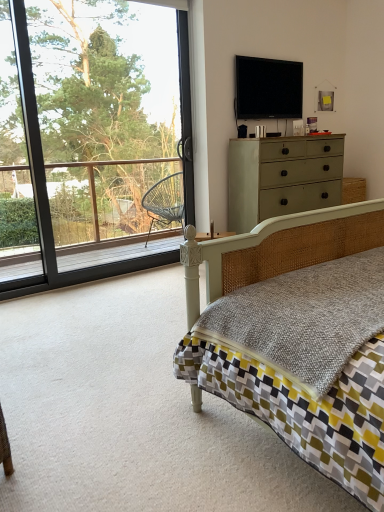
Image resolution: width=384 pixels, height=512 pixels. Describe the element at coordinates (88, 139) in the screenshot. I see `transparent glass window at upper left` at that location.

Describe the element at coordinates (300, 337) in the screenshot. This screenshot has height=512, width=384. I see `matte wicker bed at center` at that location.

You are a GUI agent. You are given a task and a screenshot of the screen. Output one action in this format:
    pyautogui.click(x=<x>, y=<y>)
    Task: Click on the transparent glass window at upper left
    This screenshot has width=384, height=512.
    Given the screenshot: What is the action you would take?
    pyautogui.click(x=88, y=139)

Considering the relative sizes of flat screen tv at upper center and matte wicker bed at center in the image provided, is flat screen tv at upper center wider than matte wicker bed at center?

No, flat screen tv at upper center is not wider than matte wicker bed at center.

Is flat screen tv at upper center closer to the viewer compared to matte wicker bed at center?

No, it is not.

From the image's perspective, does flat screen tv at upper center appear higher than matte wicker bed at center?

Yes.

How much distance is there between flat screen tv at upper center and matte wicker bed at center?

They are 2.55 meters apart.

Which of these two, transparent glass window at upper left or matte wicker bed at center, is smaller?

transparent glass window at upper left.

Is transparent glass window at upper left to the right of matte wicker bed at center from the viewer's perspective?

In fact, transparent glass window at upper left is to the left of matte wicker bed at center.

Is transparent glass window at upper left in front of or behind matte wicker bed at center in the image?

transparent glass window at upper left is behind matte wicker bed at center.

How many degrees apart are the facing directions of transparent glass window at upper left and matte wicker bed at center?

The angle between the facing direction of transparent glass window at upper left and the facing direction of matte wicker bed at center is 180 degrees.

Does matte wicker bed at center have a lesser width compared to matte green dresser at upper right?

In fact, matte wicker bed at center might be wider than matte green dresser at upper right.

From the image's perspective, between matte wicker bed at center and matte green dresser at upper right, who is located below?

matte wicker bed at center, from the image's perspective.

Which is less distant, [257,318] or [258,151]?

The point [257,318] is closer.

Is matte wicker bed at center facing towards matte green dresser at upper right?

No, matte wicker bed at center is not facing towards matte green dresser at upper right.

Considering the positions of point (151, 157) and point (257, 114), is point (151, 157) closer or farther from the camera than point (257, 114)?

Clearly, point (151, 157) is more distant from the camera than point (257, 114).

Is transparent glass window at upper left completely or partially outside of flat screen tv at upper center?

Yes, transparent glass window at upper left is outside of flat screen tv at upper center.

The width and height of the screenshot is (384, 512). Identify the location of window lying in front of the flat screen tv at upper center. (88, 139).

How far apart are transparent glass window at upper left and flat screen tv at upper center?

They are 7.39 feet apart.

Is transparent glass window at upper left oriented away from matte green dresser at upper right?

No, transparent glass window at upper left is not facing away from matte green dresser at upper right.

From a real-world perspective, is transparent glass window at upper left above or below matte green dresser at upper right?

From a real-world perspective, transparent glass window at upper left is physically above matte green dresser at upper right.

From the image's perspective, which is above, transparent glass window at upper left or matte green dresser at upper right?

transparent glass window at upper left is shown above in the image.

From the picture: Which object is positioned more to the left, transparent glass window at upper left or matte green dresser at upper right?

transparent glass window at upper left is more to the left.

The image size is (384, 512). Find the location of `the chest of drawers that is in front of the flat screen tv at upper center`. the chest of drawers that is in front of the flat screen tv at upper center is located at coordinates (282, 178).

From the image's perspective, is matte green dresser at upper right below flat screen tv at upper center?

Indeed, from the image's perspective, matte green dresser at upper right is shown beneath flat screen tv at upper center.

Consider the image. In terms of height, does matte green dresser at upper right look taller or shorter compared to flat screen tv at upper center?

matte green dresser at upper right is taller than flat screen tv at upper center.

Can you confirm if matte green dresser at upper right is positioned to the left of flat screen tv at upper center?

No.

Can you confirm if matte green dresser at upper right is wider than matte wicker bed at center?

No, matte green dresser at upper right is not wider than matte wicker bed at center.

Which is behind, point (241, 196) or point (341, 398)?

The point (241, 196) is farther.

From the image's perspective, between matte green dresser at upper right and matte wicker bed at center, which one is located above?

matte green dresser at upper right.

Image resolution: width=384 pixels, height=512 pixels. In order to click on television on the left of matte wicker bed at center in this screenshot , I will do `click(267, 89)`.

The image size is (384, 512). Find the location of `bed in front of the transparent glass window at upper left`. bed in front of the transparent glass window at upper left is located at coordinates (300, 337).

From the image, which object appears to be nearer to flat screen tv at upper center, transparent glass window at upper left or matte wicker bed at center?

Among the two, transparent glass window at upper left is located nearer to flat screen tv at upper center.

Which object lies further to the anchor point matte wicker bed at center, transparent glass window at upper left or matte green dresser at upper right?

Among the two, transparent glass window at upper left is located further to matte wicker bed at center.

Based on their spatial positions, is transparent glass window at upper left or matte green dresser at upper right closer to flat screen tv at upper center?

matte green dresser at upper right.

From the picture: Considering their positions, is matte wicker bed at center positioned further to transparent glass window at upper left than flat screen tv at upper center?

matte wicker bed at center lies further to transparent glass window at upper left than the other object.

Estimate the real-world distances between objects in this image. Which object is closer to matte wicker bed at center, flat screen tv at upper center or transparent glass window at upper left?

The object closer to matte wicker bed at center is flat screen tv at upper center.

From the image, which object appears to be farther from matte green dresser at upper right, matte wicker bed at center or flat screen tv at upper center?

Based on the image, matte wicker bed at center appears to be further to matte green dresser at upper right.

Based on their spatial positions, is transparent glass window at upper left or matte wicker bed at center further from matte green dresser at upper right?

The object further to matte green dresser at upper right is transparent glass window at upper left.

Consider the image. Based on their spatial positions, is matte green dresser at upper right or flat screen tv at upper center further from matte wicker bed at center?

The object further to matte wicker bed at center is flat screen tv at upper center.

This screenshot has height=512, width=384. In order to click on window positioned between matte wicker bed at center and flat screen tv at upper center from near to far in this screenshot , I will do `click(88, 139)`.

Identify the location of window between matte wicker bed at center and matte green dresser at upper right from front to back. (88, 139).

The width and height of the screenshot is (384, 512). Find the location of `television between transparent glass window at upper left and matte green dresser at upper right from left to right`. television between transparent glass window at upper left and matte green dresser at upper right from left to right is located at coordinates (267, 89).

The height and width of the screenshot is (512, 384). What are the coordinates of `chest of drawers between matte wicker bed at center and flat screen tv at upper center from front to back` in the screenshot? It's located at (282, 178).